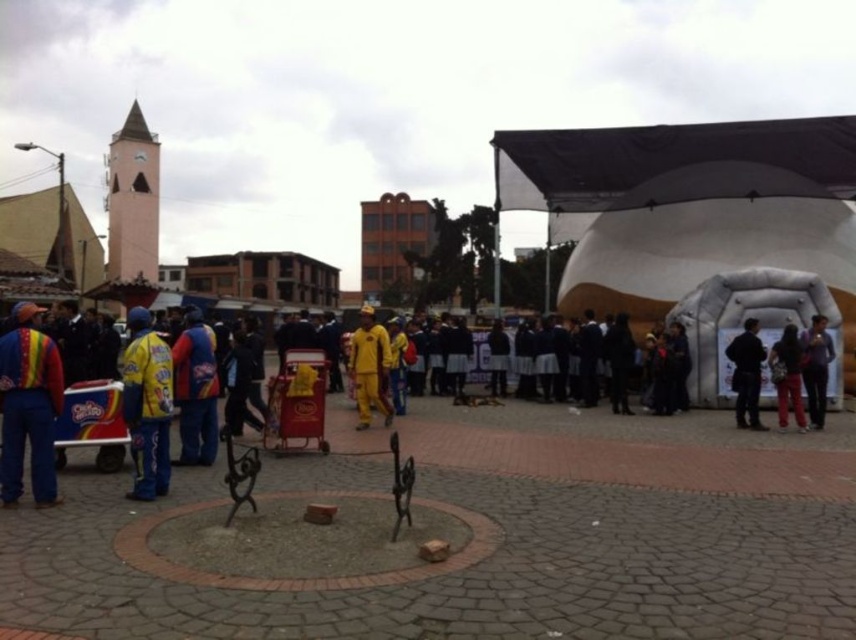
You are standing at the center of the circular paved area with the two facing sculptures. You need to locate the matte yellow jacket at left. Which direction should you face to see it?

You should face towards the left side of the image to see the matte yellow jacket at left, as it is located at point (195,388) in the scene.

From the picture: You are a photographer wanting to capture both the matte yellow jacket at left and the yellow fabric outfit at center in the same frame. Which clothing item should you focus on first to ensure both are in the shot?

The matte yellow jacket at left is narrower than the yellow fabric outfit at center, so focus on the yellow fabric outfit at center first to accommodate its wider size.